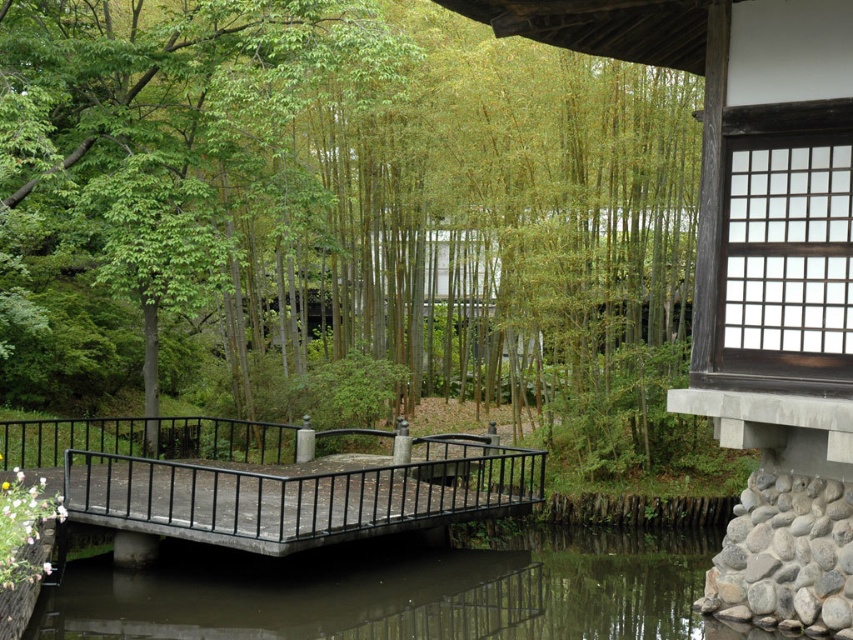
In the scene shown: Which is more to the right, green bamboo at center or rustic wood bridge at center?

green bamboo at center is more to the right.

Does green bamboo at center appear on the right side of rustic wood bridge at center?

Correct, you'll find green bamboo at center to the right of rustic wood bridge at center.

Is point (83, 381) behind point (219, 484)?

That is True.

Where is `green bamboo at center`? The width and height of the screenshot is (853, 640). green bamboo at center is located at coordinates (334, 204).

Between clear water at bridge center and rustic wood bridge at center, which one has more height?

With more height is rustic wood bridge at center.

Can you confirm if clear water at bridge center is shorter than rustic wood bridge at center?

Correct, clear water at bridge center is not as tall as rustic wood bridge at center.

Does point (635, 536) come closer to viewer compared to point (238, 464)?

Yes, point (635, 536) is in front of point (238, 464).

What are the coordinates of `clear water at bridge center` in the screenshot? It's located at (402, 592).

Which is above, green bamboo at center or clear water at bridge center?

Positioned higher is green bamboo at center.

Which of these two, green bamboo at center or clear water at bridge center, stands taller?

With more height is green bamboo at center.

You are a GUI agent. You are given a task and a screenshot of the screen. Output one action in this format:
    pyautogui.click(x=<x>, y=<y>)
    Task: Click on the green bamboo at center
    The width and height of the screenshot is (853, 640).
    Given the screenshot: What is the action you would take?
    pyautogui.click(x=334, y=204)